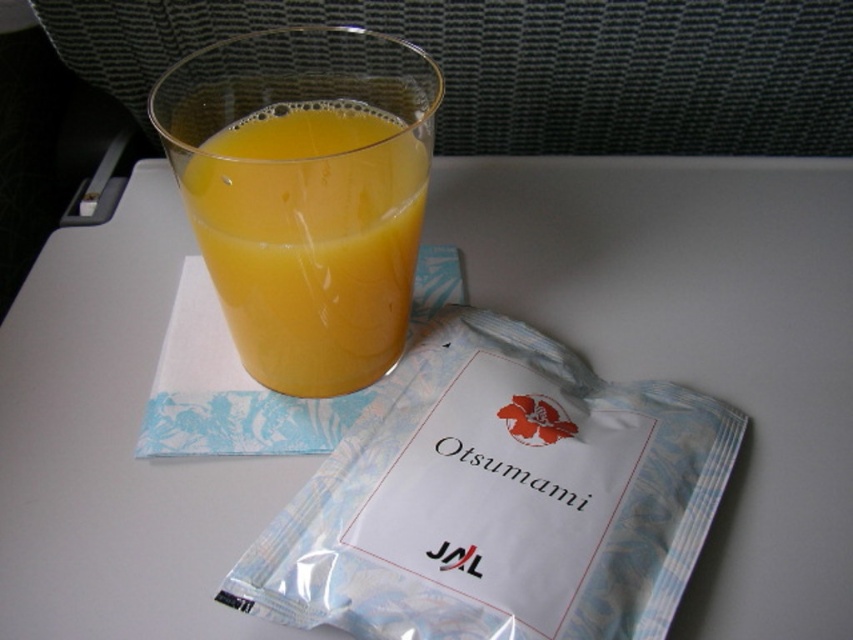
Between transparent plastic pouch at upper center and translucent glass at upper center, which one appears on the right side from the viewer's perspective?

transparent plastic pouch at upper center is more to the right.

Between transparent plastic pouch at upper center and translucent glass at upper center, which one has less height?

Standing shorter between the two is transparent plastic pouch at upper center.

Where is `transparent plastic pouch at upper center`? transparent plastic pouch at upper center is located at coordinates (498, 499).

At what (x,y) coordinates should I click in order to perform the action: click on transparent plastic pouch at upper center. Please return your answer as a coordinate pair (x, y). Looking at the image, I should click on (498, 499).